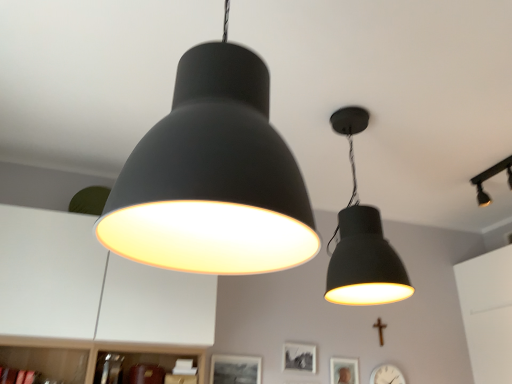
Question: Considering the relative sizes of gold metallic crucifix at lower right and matte black picture frame at lower center, which appears as the 3th picture frame when viewed from the right, in the image provided, is gold metallic crucifix at lower right wider than matte black picture frame at lower center, which appears as the 3th picture frame when viewed from the right,?

Choices:
 (A) no
 (B) yes

Answer: (B)

Question: Can you confirm if gold metallic crucifix at lower right is bigger than matte black picture frame at lower center, which appears as the 3th picture frame when viewed from the right?

Choices:
 (A) yes
 (B) no

Answer: (B)

Question: Does gold metallic crucifix at lower right have a lesser height compared to matte black picture frame at lower center, the 1th picture frame viewed from the left?

Choices:
 (A) no
 (B) yes

Answer: (B)

Question: Is gold metallic crucifix at lower right oriented towards matte black picture frame at lower center, the 1th picture frame viewed from the left?

Choices:
 (A) no
 (B) yes

Answer: (A)

Question: Considering the relative sizes of gold metallic crucifix at lower right and matte black picture frame at lower center, which appears as the 3th picture frame when viewed from the right, in the image provided, is gold metallic crucifix at lower right taller than matte black picture frame at lower center, which appears as the 3th picture frame when viewed from the right,?

Choices:
 (A) no
 (B) yes

Answer: (A)

Question: From the image's perspective, is matte black picture frame at center, which is counted as the 2th picture frame, starting from the left, above or below matte black lampshade at upper center, which is the 3th lamp from right to left?

Choices:
 (A) above
 (B) below

Answer: (B)

Question: Is matte black picture frame at center, which is counted as the 2th picture frame, starting from the left, taller or shorter than matte black lampshade at upper center, which is the 3th lamp from right to left?

Choices:
 (A) short
 (B) tall

Answer: (A)

Question: Is matte black picture frame at center, which is counted as the 2th picture frame, starting from the left, spatially inside matte black lampshade at upper center, positioned as the first lamp in left-to-right order, or outside of it?

Choices:
 (A) outside
 (B) inside

Answer: (A)

Question: Looking at their shapes, would you say matte black picture frame at center, the 2th picture frame in the right-to-left sequence, is wider or thinner than matte black lampshade at upper center, the third lamp positioned from the back?

Choices:
 (A) thin
 (B) wide

Answer: (A)

Question: Is point (309, 370) positioned closer to the camera than point (245, 369)?

Choices:
 (A) farther
 (B) closer

Answer: (A)

Question: From the image's perspective, relative to matte black picture frame at lower center, the 1th picture frame viewed from the left, is matte black picture frame at center, the 2th picture frame in the right-to-left sequence, above or below?

Choices:
 (A) below
 (B) above

Answer: (B)

Question: Choose the correct answer: Is matte black picture frame at center, the 2th picture frame in the right-to-left sequence, inside matte black picture frame at lower center, the 1th picture frame viewed from the left, or outside it?

Choices:
 (A) inside
 (B) outside

Answer: (B)

Question: Looking at their shapes, would you say matte black picture frame at center, which is counted as the 2th picture frame, starting from the left, is wider or thinner than matte black picture frame at lower center, which appears as the 3th picture frame when viewed from the right?

Choices:
 (A) thin
 (B) wide

Answer: (B)

Question: From a real-world perspective, is matte black track light at upper right, the 3th lamp viewed from the left, above or below matte black picture frame at lower center, the 1th picture frame viewed from the left?

Choices:
 (A) below
 (B) above

Answer: (B)

Question: From the image's perspective, relative to matte black picture frame at lower center, which appears as the 3th picture frame when viewed from the right, is matte black track light at upper right, which is the first lamp in right-to-left order, above or below?

Choices:
 (A) below
 (B) above

Answer: (B)